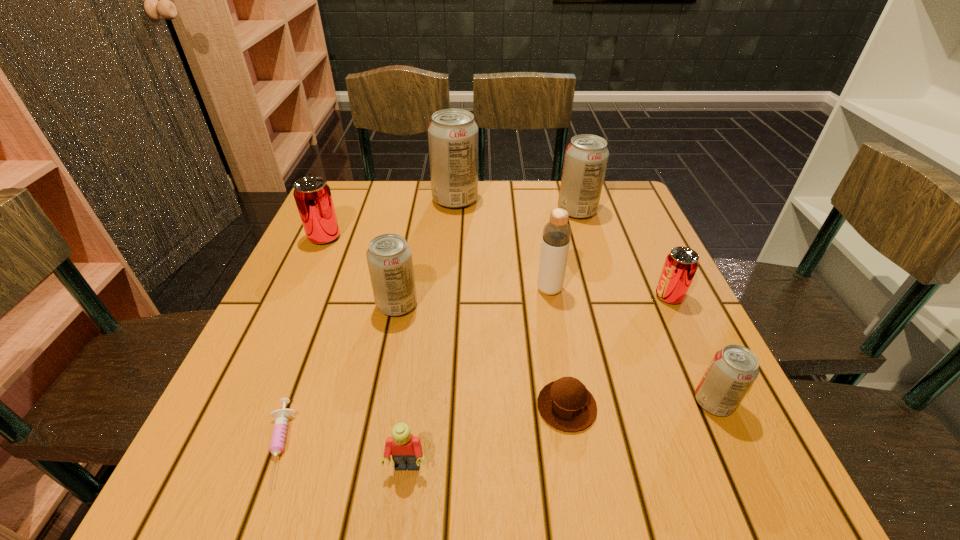
Locate an element on the screen. The image size is (960, 540). the rightmost gray soda can is located at coordinates (733, 369).

The image size is (960, 540). In order to click on the nearest soda can in this screenshot , I will do `click(733, 369)`.

This screenshot has height=540, width=960. I want to click on the third shortest object, so click(406, 450).

Where is `brown muffin`? This screenshot has height=540, width=960. brown muffin is located at coordinates (565, 404).

The image size is (960, 540). I want to click on the second shortest object, so click(565, 404).

Where is `syringe`? Image resolution: width=960 pixels, height=540 pixels. syringe is located at coordinates pyautogui.click(x=278, y=437).

I want to click on white syringe, so click(x=278, y=437).

You are a GUI agent. You are given a task and a screenshot of the screen. Output one action in this format:
    pyautogui.click(x=<x>, y=<y>)
    Task: Click on the vacant space located on the left of the tallest soda can
    The image size is (960, 540).
    Given the screenshot: What is the action you would take?
    pyautogui.click(x=364, y=200)

Find the location of a particular element. vacant region located on the left of the second biggest gray soda can is located at coordinates (426, 211).

This screenshot has width=960, height=540. Find the location of `free location located 0.070m on the back of the bottle`. free location located 0.070m on the back of the bottle is located at coordinates (544, 261).